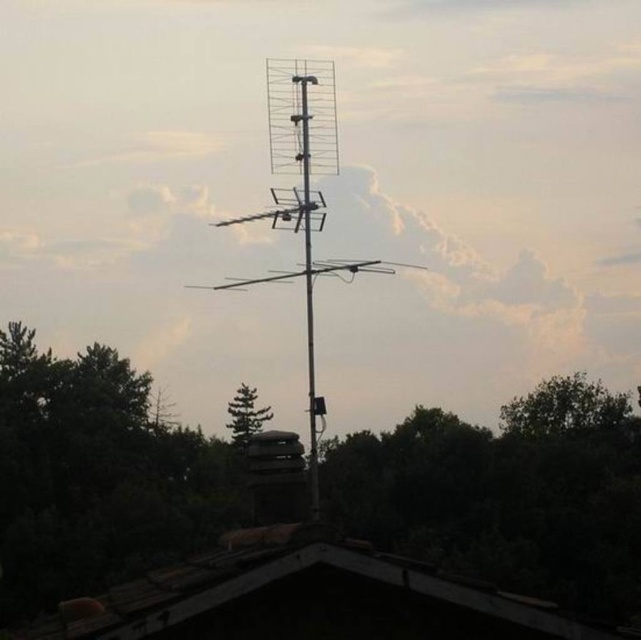
You are a delivery drone trying to land on the rooftop. The brown wooden roof at lower center and the metallic antenna at center are in your path. Considering their widths, which one do you need to avoid to ensure a safe landing?

The brown wooden roof at lower center has a smaller width than the metallic antenna at center. To ensure a safe landing, you should avoid the metallic antenna at center since it is wider and could obstruct the drone.

You are a city planner reviewing this rooftop layout. You need to ensure that the metallic antenna at center and the green matte tree at center do not block each other. Based on their widths, which object is wider and might cause more obstruction?

The metallic antenna at center is wider than the green matte tree at center, so it might cause more obstruction.

You are standing on the rooftop and want to take a photo of the metallic antenna at center without the green leafy tree at center blocking it. Which direction should you move to ensure the tree is out of frame?

Move to the right side of the metallic antenna at center so that the green leafy tree at center, which is on its left, will be out of the frame.